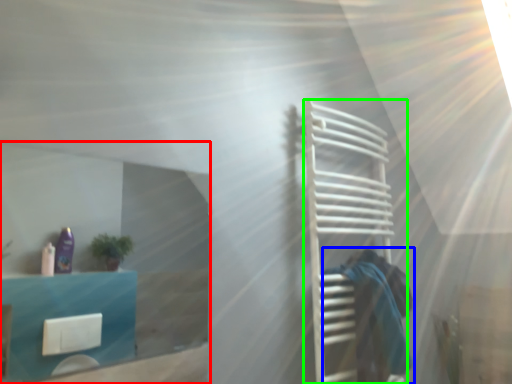
Question: Based on their relative distances, which object is farther from glass door (highlighted by a red box)? Choose from person (highlighted by a blue box) and cage (highlighted by a green box).

Choices:
 (A) person
 (B) cage

Answer: (A)